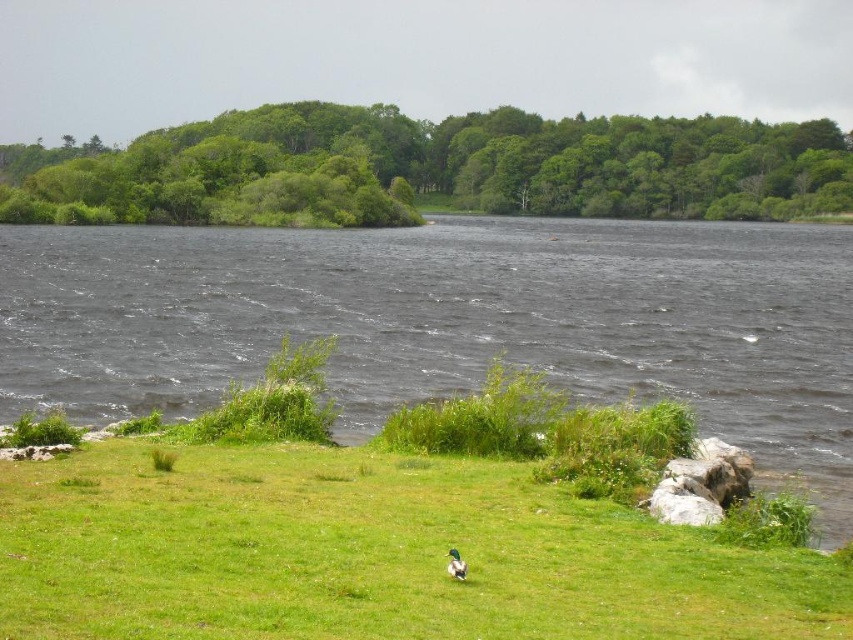
You are standing at the origin point in the image and want to reach the duck in the foreground. Which point should you walk towards first, point (654,365) or point (689,465)?

You should walk towards point (689,465) first because point (654,365) is behind it, meaning point (689,465) is closer to you.

You are a hiker who wants to cross the lake from the green leafy trees at upper center to the gray rock at lower right. Given that your boat can carry a maximum weight of 200 kg, and you weigh 70 kg, can you safely take a 130 kg backpack with you?

The distance between green leafy trees at upper center and gray rock at lower right is 202.10 meters. Since your total weight with the backpack is 200 kg, which is exactly the boat maximum, you can safely take the backpack as long as there are no additional items or people.